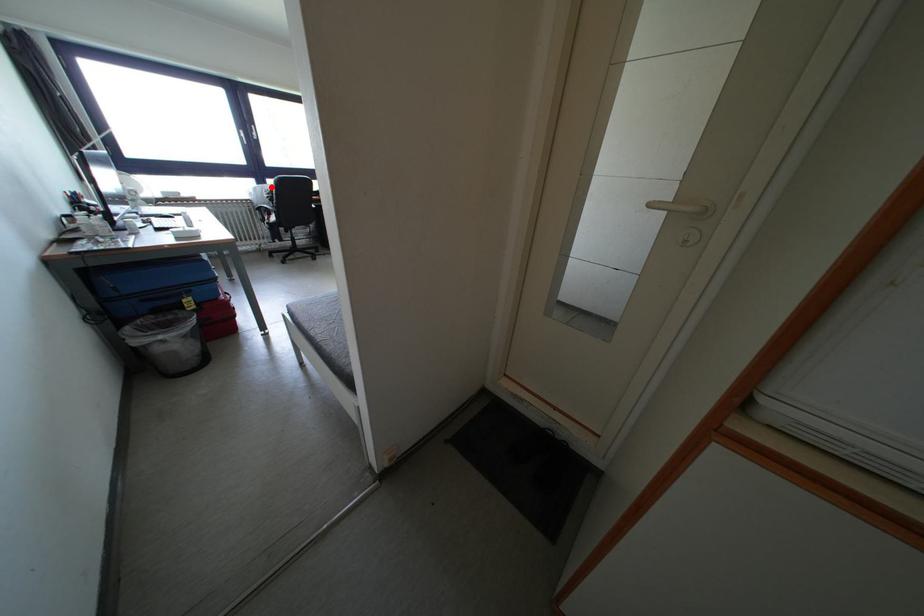
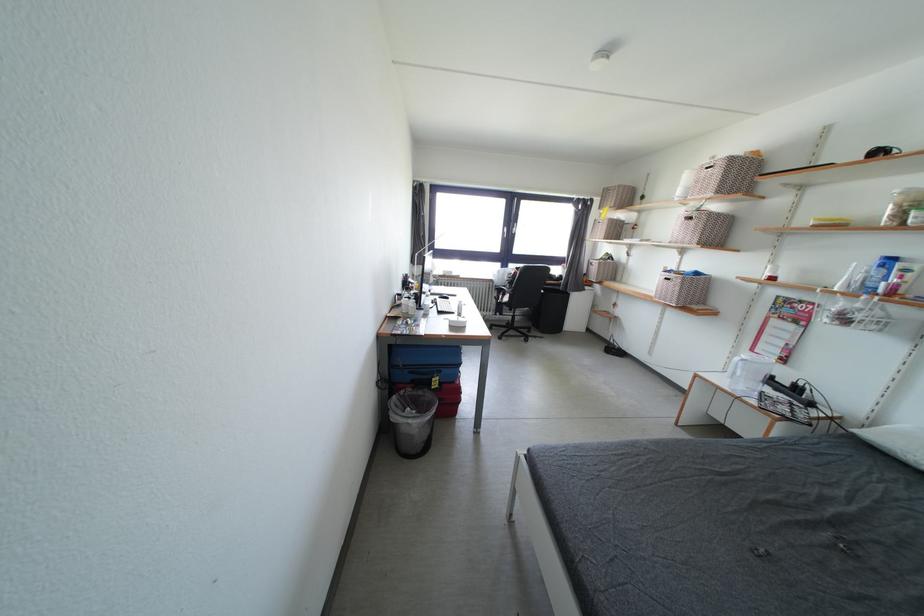
Find the pixel in the second image that matches the highlighted location in the first image.

(514, 270)